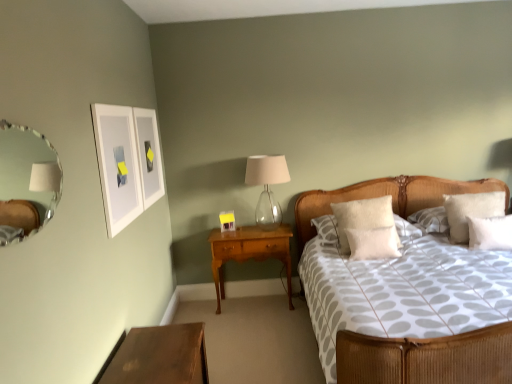
Question: Which direction should I rotate to look at white soft pillow at center, which is counted as the 3th pillow, starting from the right?

Choices:
 (A) right
 (B) left

Answer: (A)

Question: From a real-world perspective, is white fluffy pillow at upper right, the 1th pillow positioned from the right, physically below white matte picture frame at upper left?

Choices:
 (A) yes
 (B) no

Answer: (A)

Question: Is white fluffy pillow at upper right, the 1th pillow positioned from the right, with white matte picture frame at upper left?

Choices:
 (A) no
 (B) yes

Answer: (A)

Question: Can white matte picture frame at upper left be found inside white fluffy pillow at upper right, which is the 4th pillow in left-to-right order?

Choices:
 (A) yes
 (B) no

Answer: (B)

Question: Can you confirm if white fluffy pillow at upper right, the 1th pillow positioned from the right, is smaller than white matte picture frame at upper left?

Choices:
 (A) no
 (B) yes

Answer: (A)

Question: Could you tell me if white fluffy pillow at upper right, the 1th pillow positioned from the right, is turned towards white matte picture frame at upper left?

Choices:
 (A) no
 (B) yes

Answer: (A)

Question: Would you consider white fluffy pillow at upper right, which is the 4th pillow in left-to-right order, to be distant from white matte picture frame at upper left?

Choices:
 (A) yes
 (B) no

Answer: (A)

Question: Is white matte picture frame at upper left taller than white soft pillow at right, which ranks as the 2th pillow in right-to-left order?

Choices:
 (A) no
 (B) yes

Answer: (B)

Question: Is white matte picture frame at upper left to the left of white soft pillow at right, which ranks as the 2th pillow in right-to-left order, from the viewer's perspective?

Choices:
 (A) no
 (B) yes

Answer: (B)

Question: From the image's perspective, is white matte picture frame at upper left on white soft pillow at right, positioned as the 3th pillow in left-to-right order?

Choices:
 (A) yes
 (B) no

Answer: (A)

Question: Is white matte picture frame at upper left facing towards white soft pillow at right, which ranks as the 2th pillow in right-to-left order?

Choices:
 (A) no
 (B) yes

Answer: (B)

Question: Is white matte picture frame at upper left located outside white soft pillow at right, which ranks as the 2th pillow in right-to-left order?

Choices:
 (A) yes
 (B) no

Answer: (A)

Question: From a real-world perspective, is white matte picture frame at upper left located beneath white soft pillow at right, which ranks as the 2th pillow in right-to-left order?

Choices:
 (A) yes
 (B) no

Answer: (B)

Question: Is white soft pillow at center, the 2th pillow positioned from the left, positioned with its back to white fluffy pillow at center, positioned as the 4th pillow in right-to-left order?

Choices:
 (A) yes
 (B) no

Answer: (A)